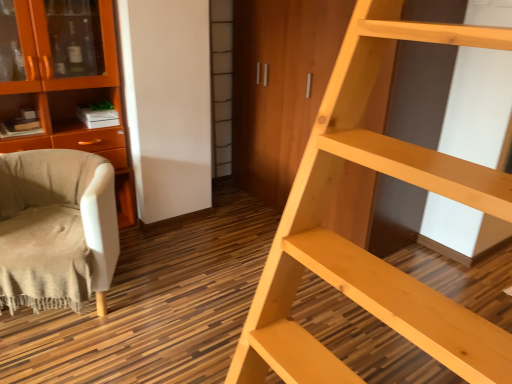
Question: Is light wood ladder at right facing towards orange wood cabinet at left?

Choices:
 (A) no
 (B) yes

Answer: (A)

Question: Can you confirm if light wood ladder at right is taller than orange wood cabinet at left?

Choices:
 (A) yes
 (B) no

Answer: (A)

Question: Can you confirm if light wood ladder at right is shorter than orange wood cabinet at left?

Choices:
 (A) no
 (B) yes

Answer: (A)

Question: Does light wood ladder at right touch orange wood cabinet at left?

Choices:
 (A) yes
 (B) no

Answer: (B)

Question: Is light wood ladder at right located outside orange wood cabinet at left?

Choices:
 (A) yes
 (B) no

Answer: (A)

Question: Is orange wood cabinet at left taller or shorter than beige fabric chair at left?

Choices:
 (A) tall
 (B) short

Answer: (A)

Question: In terms of width, does orange wood cabinet at left look wider or thinner when compared to beige fabric chair at left?

Choices:
 (A) wide
 (B) thin

Answer: (B)

Question: Is point (132, 208) positioned closer to the camera than point (101, 215)?

Choices:
 (A) closer
 (B) farther

Answer: (B)

Question: From a real-world perspective, is orange wood cabinet at left positioned above or below beige fabric chair at left?

Choices:
 (A) above
 (B) below

Answer: (A)

Question: Considering the relative positions of beige fabric chair at left and orange wood cabinet at left in the image provided, is beige fabric chair at left to the left or to the right of orange wood cabinet at left?

Choices:
 (A) left
 (B) right

Answer: (B)

Question: From a real-world perspective, is beige fabric chair at left physically located above or below orange wood cabinet at left?

Choices:
 (A) below
 (B) above

Answer: (A)

Question: From their relative heights in the image, would you say beige fabric chair at left is taller or shorter than orange wood cabinet at left?

Choices:
 (A) short
 (B) tall

Answer: (A)

Question: In terms of size, does beige fabric chair at left appear bigger or smaller than orange wood cabinet at left?

Choices:
 (A) big
 (B) small

Answer: (B)

Question: Based on their positions, is light wood ladder at right located to the left or right of orange wood cabinet at left?

Choices:
 (A) left
 (B) right

Answer: (B)

Question: From a real-world perspective, is light wood ladder at right positioned above or below orange wood cabinet at left?

Choices:
 (A) above
 (B) below

Answer: (A)